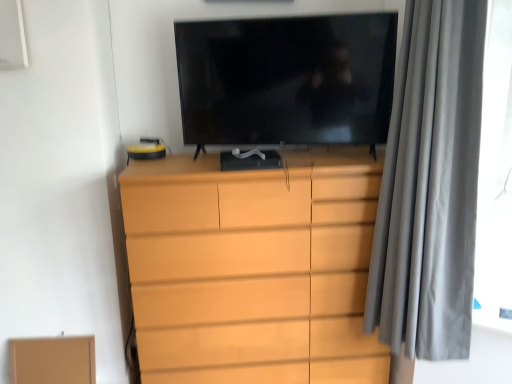
The width and height of the screenshot is (512, 384). Identify the location of vacant area on top of brown cardboard box at lower left (from a real-world perspective). (51, 336).